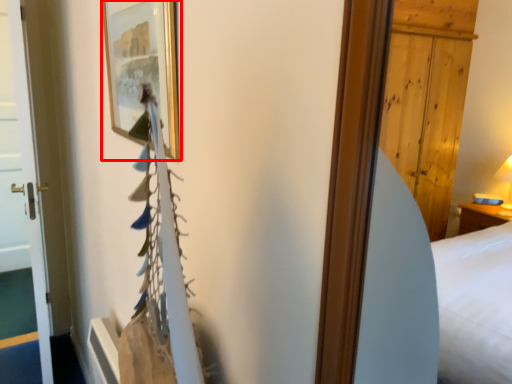
Question: From the image's perspective, what is the correct spatial relationship of picture frame (annotated by the red box) in relation to door?

Choices:
 (A) below
 (B) above

Answer: (B)